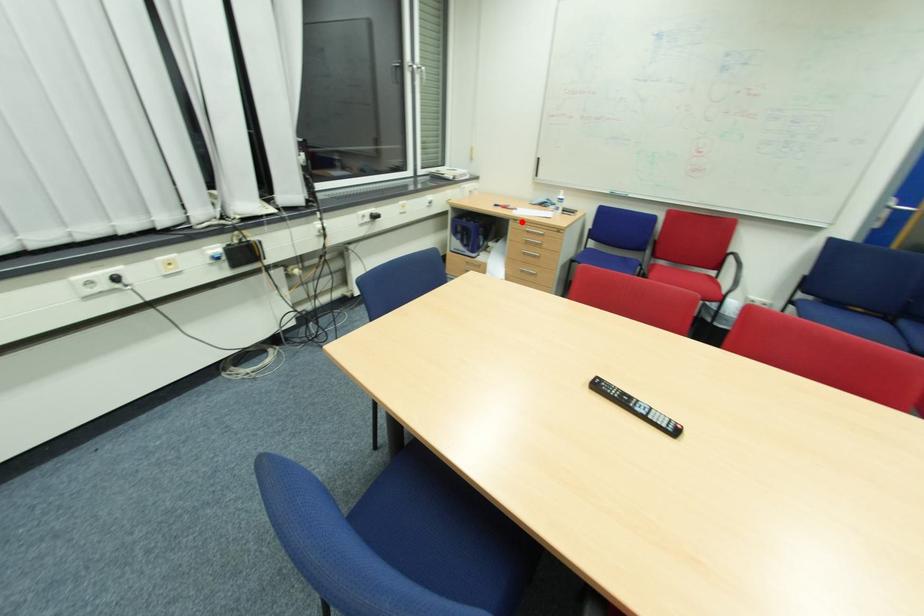
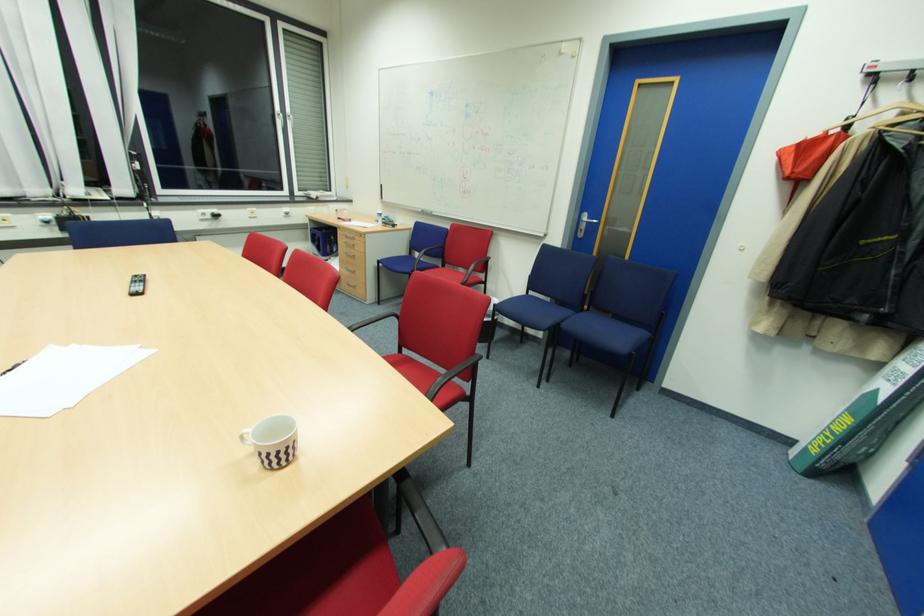
Question: I am providing you with two images of the same scene from different viewpoints. Image1 has a red point marked. In image2, the corresponding 3D location appears at what relative position? Reply with the corresponding letter.

Choices:
 (A) Closer
 (B) Farther

Answer: (B)